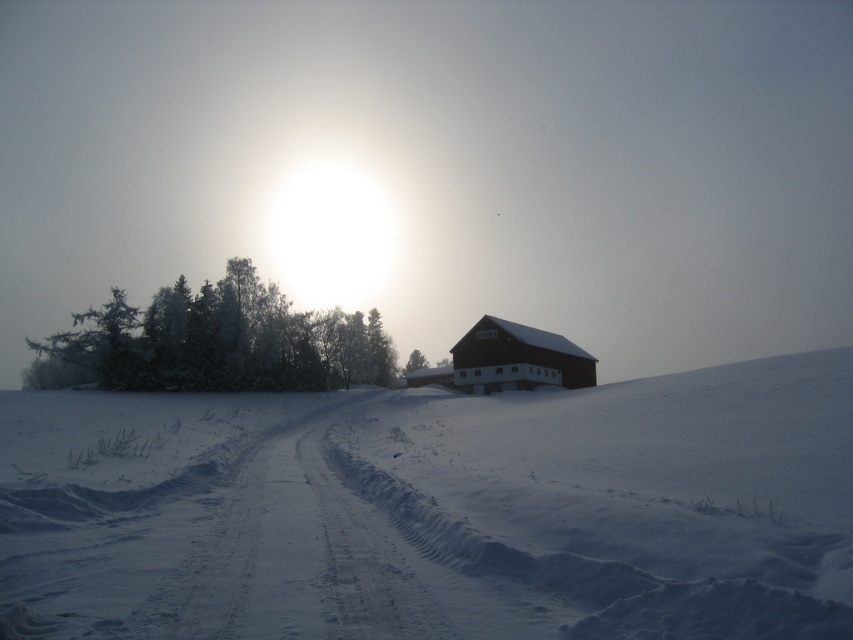
Does point (810, 428) lie in front of point (520, 355)?

That is True.

Between white powdery snow at center and dark brown wooden barn at center, which one has more height?

With more height is dark brown wooden barn at center.

Which is behind, point (614, 408) or point (546, 333)?

The point (546, 333) is behind.

Locate an element on the screen. The height and width of the screenshot is (640, 853). white powdery snow at center is located at coordinates (436, 509).

Can you confirm if white powdery snow at center is smaller than snow-covered trees at left?

Indeed, white powdery snow at center has a smaller size compared to snow-covered trees at left.

Image resolution: width=853 pixels, height=640 pixels. Describe the element at coordinates (436, 509) in the screenshot. I see `white powdery snow at center` at that location.

Is point (465, 499) more distant than point (44, 384)?

No, (465, 499) is in front of (44, 384).

The height and width of the screenshot is (640, 853). What are the coordinates of `white powdery snow at center` in the screenshot? It's located at (436, 509).

Describe the element at coordinates (213, 342) in the screenshot. This screenshot has height=640, width=853. I see `snow-covered trees at left` at that location.

Where is `snow-covered trees at left`? This screenshot has width=853, height=640. snow-covered trees at left is located at coordinates (213, 342).